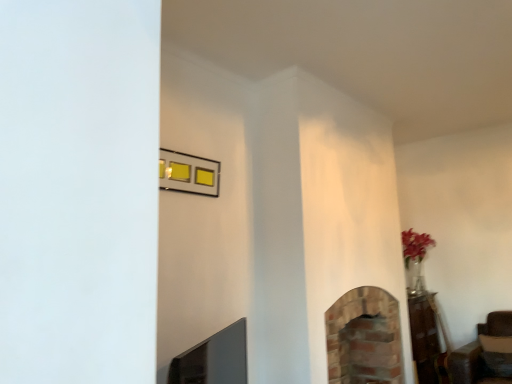
Question: Can you confirm if metallic gold picture frame at upper center is smaller than brick fireplace at center, the second fireplace in the left-to-right sequence?

Choices:
 (A) no
 (B) yes

Answer: (B)

Question: From a real-world perspective, is metallic gold picture frame at upper center on top of brick fireplace at center, the second fireplace in the left-to-right sequence?

Choices:
 (A) no
 (B) yes

Answer: (B)

Question: Does metallic gold picture frame at upper center have a larger size compared to brick fireplace at center, the second fireplace in the left-to-right sequence?

Choices:
 (A) yes
 (B) no

Answer: (B)

Question: Is the depth of metallic gold picture frame at upper center less than that of brick fireplace at center, which is the 1th fireplace from right to left?

Choices:
 (A) yes
 (B) no

Answer: (A)

Question: Is brick fireplace at center, the second fireplace in the left-to-right sequence, completely or partially inside metallic gold picture frame at upper center?

Choices:
 (A) no
 (B) yes

Answer: (A)

Question: From the image's perspective, is brick fireplace at center, the second fireplace in the left-to-right sequence, positioned above or below brick fireplace at lower center, marked as the first fireplace in a front-to-back arrangement?

Choices:
 (A) below
 (B) above

Answer: (A)

Question: Is brick fireplace at center, the 1th fireplace viewed from the back, to the left or to the right of brick fireplace at lower center, the first fireplace when ordered from left to right, in the image?

Choices:
 (A) left
 (B) right

Answer: (B)

Question: Is brick fireplace at center, the second fireplace in the left-to-right sequence, inside the boundaries of brick fireplace at lower center, the second fireplace viewed from the right, or outside?

Choices:
 (A) inside
 (B) outside

Answer: (B)

Question: In the image, is brick fireplace at center, which appears as the 2th fireplace when viewed from the front, positioned in front of or behind brick fireplace at lower center, marked as the first fireplace in a front-to-back arrangement?

Choices:
 (A) front
 (B) behind

Answer: (B)

Question: Looking at their shapes, would you say brick fireplace at lower center, the first fireplace when ordered from left to right, is wider or thinner than metallic gold picture frame at upper center?

Choices:
 (A) wide
 (B) thin

Answer: (A)

Question: From the image's perspective, is brick fireplace at lower center, positioned as the 2th fireplace in back-to-front order, positioned above or below metallic gold picture frame at upper center?

Choices:
 (A) below
 (B) above

Answer: (A)

Question: From a real-world perspective, is brick fireplace at lower center, the second fireplace viewed from the right, above or below metallic gold picture frame at upper center?

Choices:
 (A) above
 (B) below

Answer: (B)

Question: In the image, is brick fireplace at lower center, the second fireplace viewed from the right, on the left side or the right side of metallic gold picture frame at upper center?

Choices:
 (A) left
 (B) right

Answer: (B)

Question: From a real-world perspective, is brick fireplace at lower center, the first fireplace when ordered from left to right, above or below brick fireplace at center, the second fireplace in the left-to-right sequence?

Choices:
 (A) below
 (B) above

Answer: (B)

Question: Is brick fireplace at lower center, the second fireplace viewed from the right, in front of or behind brick fireplace at center, the second fireplace in the left-to-right sequence, in the image?

Choices:
 (A) front
 (B) behind

Answer: (A)